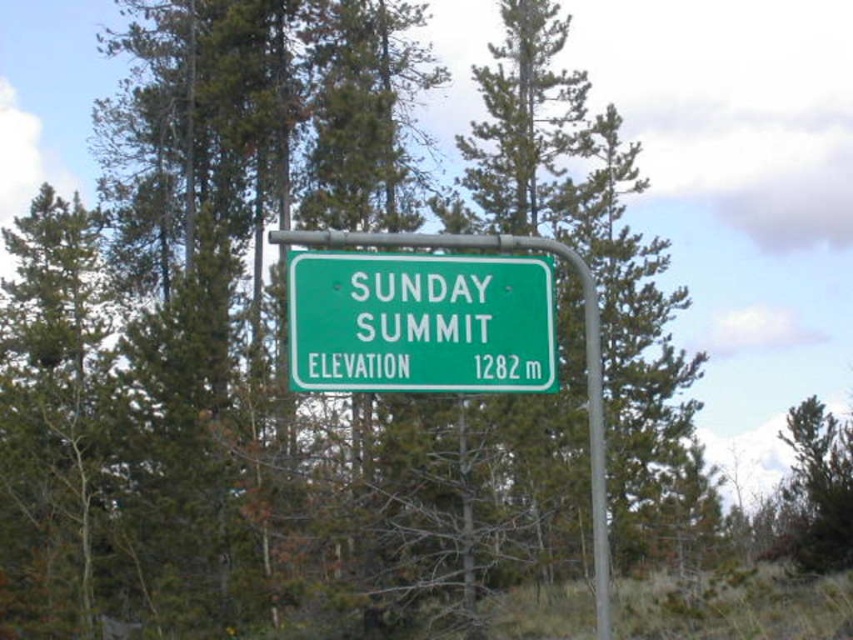
You are a hiker planning to take a photo of the green matte sign at center and the green pine tree at center. Which object should you focus on first if you want both to be in sharp focus, considering their sizes?

The green pine tree at center is wider than the green matte sign at center, so you should focus on the green pine tree at center first to ensure both are in sharp focus.